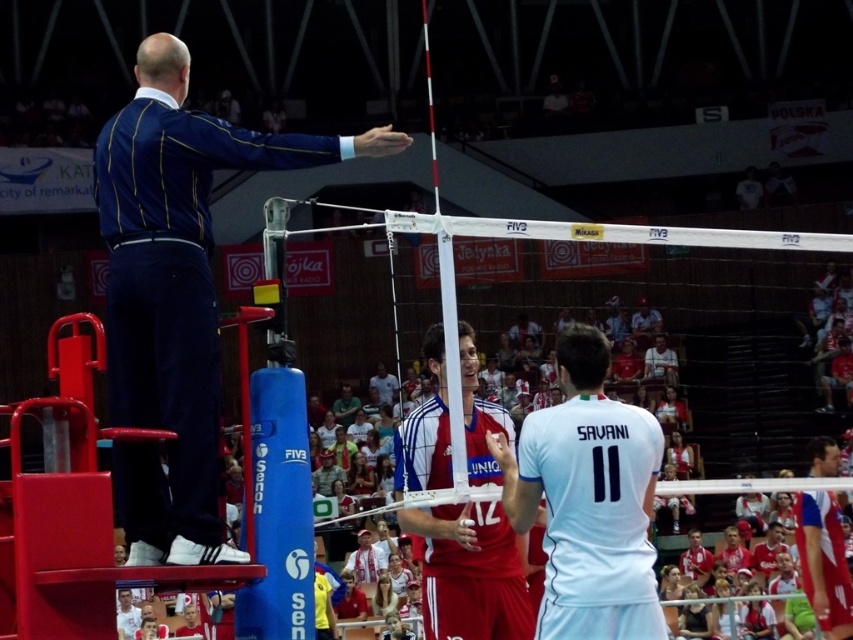
Based on the photo, can you confirm if blue striped suit at upper left is positioned to the right of white jersey at center?

No, blue striped suit at upper left is not to the right of white jersey at center.

Who is higher up, blue striped suit at upper left or white jersey at center?

blue striped suit at upper left is higher up.

This screenshot has height=640, width=853. Describe the element at coordinates (177, 294) in the screenshot. I see `blue striped suit at upper left` at that location.

At what (x,y) coordinates should I click in order to perform the action: click on blue striped suit at upper left. Please return your answer as a coordinate pair (x, y). Looking at the image, I should click on (177, 294).

Is point (165, 182) behind point (402, 474)?

No, it is not.

Does point (213, 420) come in front of point (465, 516)?

Yes.

Measure the distance between blue striped suit at upper left and camera.

A distance of 78.86 feet exists between blue striped suit at upper left and camera.

Locate an element on the screen. blue striped suit at upper left is located at coordinates (177, 294).

Does white jersey at center have a lesser height compared to red jersey at center?

Correct, white jersey at center is not as tall as red jersey at center.

This screenshot has height=640, width=853. What are the coordinates of `white jersey at center` in the screenshot? It's located at (589, 499).

I want to click on white jersey at center, so click(x=589, y=499).